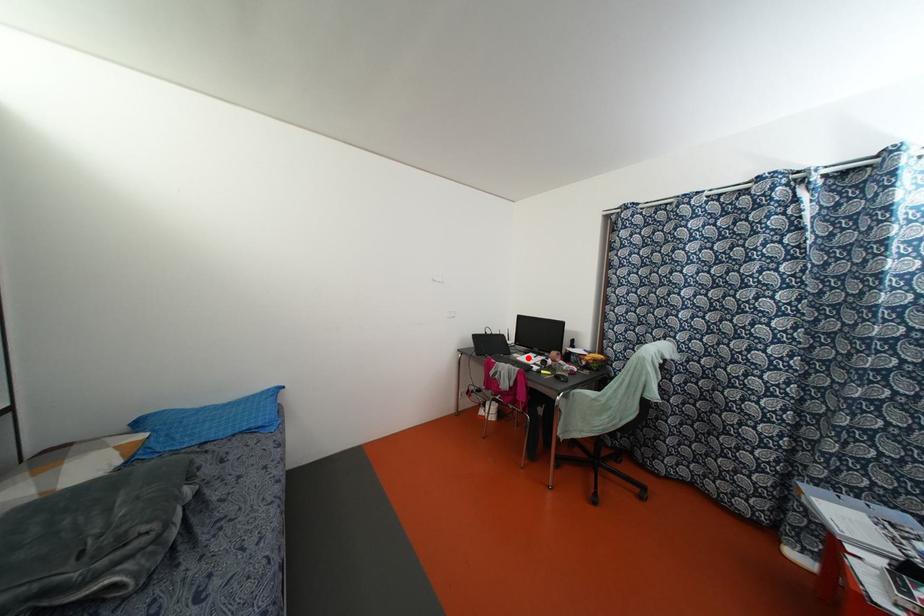
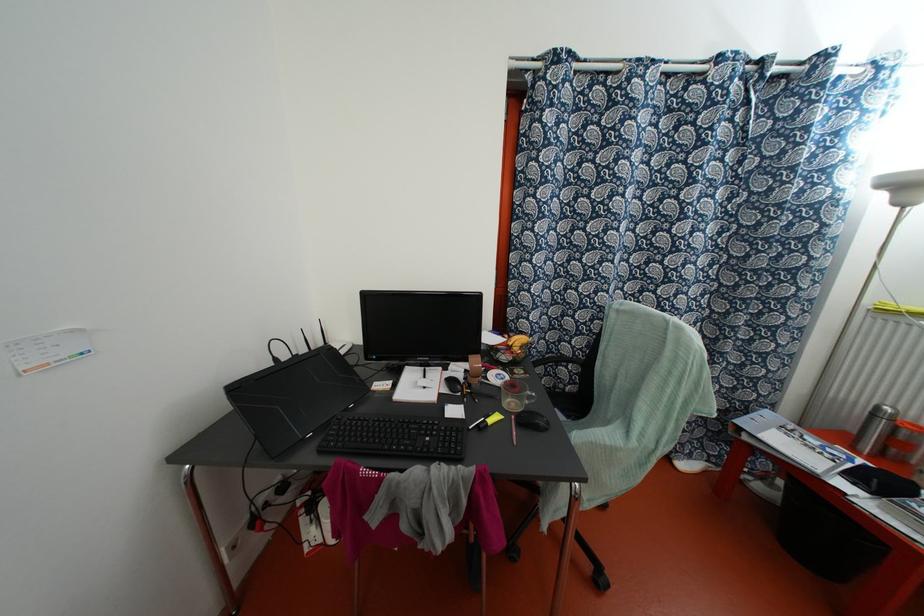
Where in the second image is the point corresponding to the highlighted location from the first image?

(418, 386)